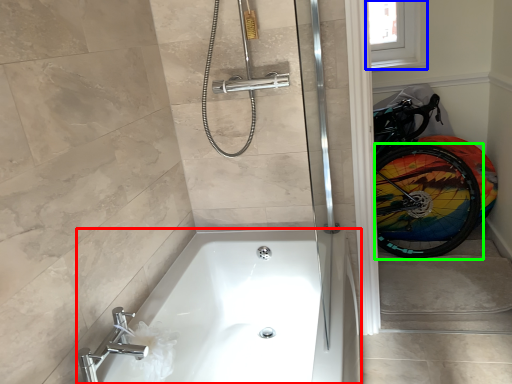
Question: Which object is the closest to the bathtub (highlighted by a red box)? Choose among these: window screen (highlighted by a blue box) or bicycle wheel (highlighted by a green box).

Choices:
 (A) window screen
 (B) bicycle wheel

Answer: (B)